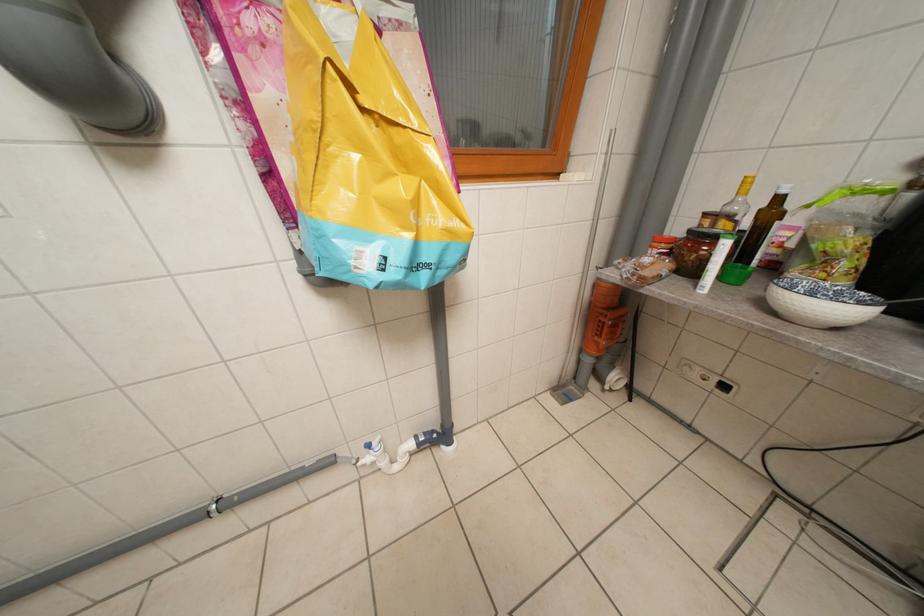
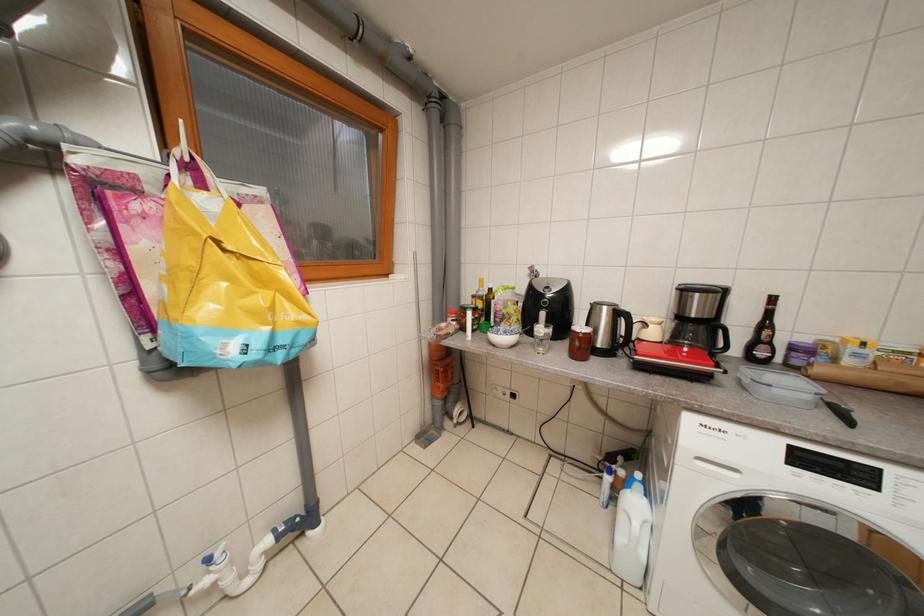
Question: The images are taken continuously from a first-person perspective. In which direction is your viewpoint rotating?

Choices:
 (A) Left
 (B) Right
 (C) Up
 (D) Down

Answer: (B)